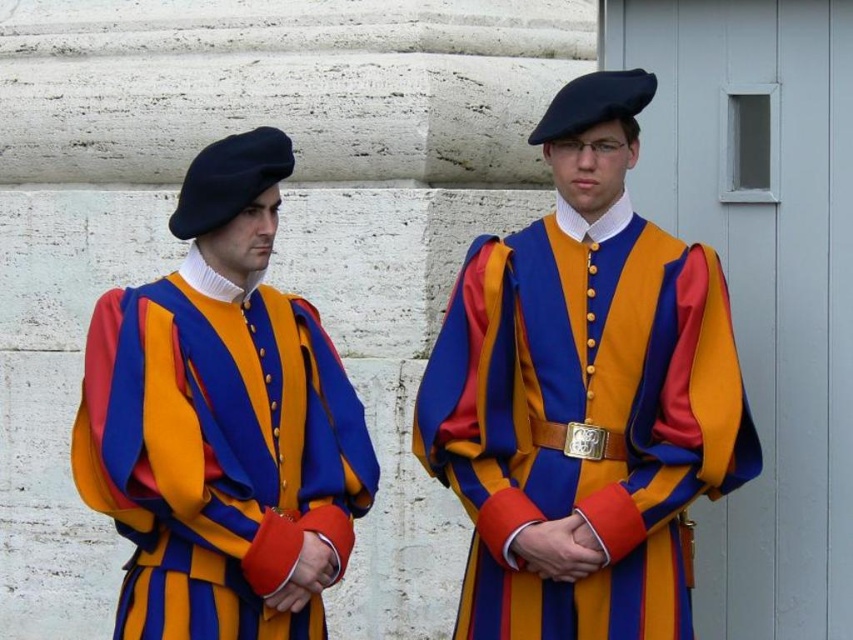
Question: Which of the following is the closest to the observer?

Choices:
 (A) (486, 413)
 (B) (109, 413)

Answer: (B)

Question: Is matte woolen uniform at center positioned at the back of matte wool beret at left?

Choices:
 (A) no
 (B) yes

Answer: (B)

Question: Does matte woolen uniform at center have a smaller size compared to matte wool beret at left?

Choices:
 (A) yes
 (B) no

Answer: (B)

Question: Can you confirm if matte woolen uniform at center is bigger than matte wool beret at left?

Choices:
 (A) yes
 (B) no

Answer: (A)